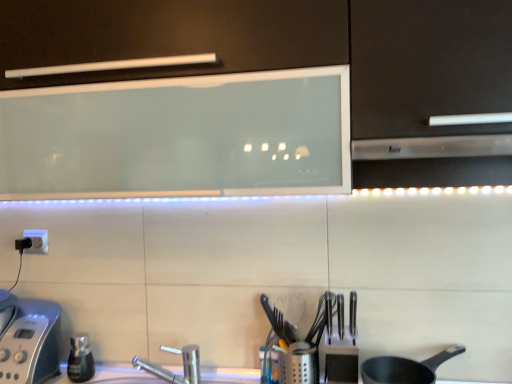
Question: In the image, is metallic silver utensil holder at center, the second appliance when ordered from left to right, on the left side or the right side of silver metallic toaster at lower left, positioned as the 1th appliance in left-to-right order?

Choices:
 (A) right
 (B) left

Answer: (A)

Question: From the image's perspective, is metallic silver utensil holder at center, the second appliance when ordered from left to right, above or below silver metallic toaster at lower left, the 2th appliance from the right?

Choices:
 (A) above
 (B) below

Answer: (B)

Question: Considering the real-world distances, which object is farthest from the metallic silver utensil holder at center, acting as the 1th appliance starting from the right?

Choices:
 (A) white glossy countertop at center
 (B) silver metallic faucet at lower center
 (C) matte black frying pan at lower right
 (D) polished metal knives at center
 (E) satin silver exhaust hood at right

Answer: (E)

Question: Which is farther from the polished metal knives at center?

Choices:
 (A) matte black frying pan at lower right
 (B) white glossy countertop at center
 (C) silver metallic toaster at lower left, the 2th appliance from the right
 (D) silver metallic faucet at lower center
 (E) satin silver exhaust hood at right

Answer: (C)